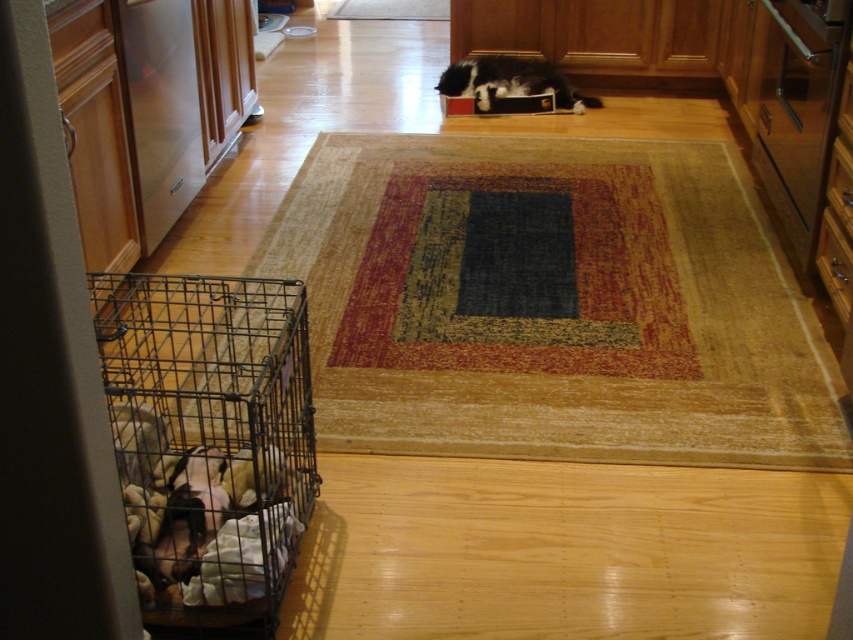
Question: Is metal wire cage at lower left above black and white fur cat at center?

Choices:
 (A) no
 (B) yes

Answer: (A)

Question: Is metal wire cage at lower left positioned behind black and white fur cat at center?

Choices:
 (A) no
 (B) yes

Answer: (A)

Question: Can you confirm if metal wire cage at lower left is positioned to the left of black and white fur cat at center?

Choices:
 (A) yes
 (B) no

Answer: (A)

Question: Which point is farther to the camera?

Choices:
 (A) (120, 392)
 (B) (479, 104)

Answer: (B)